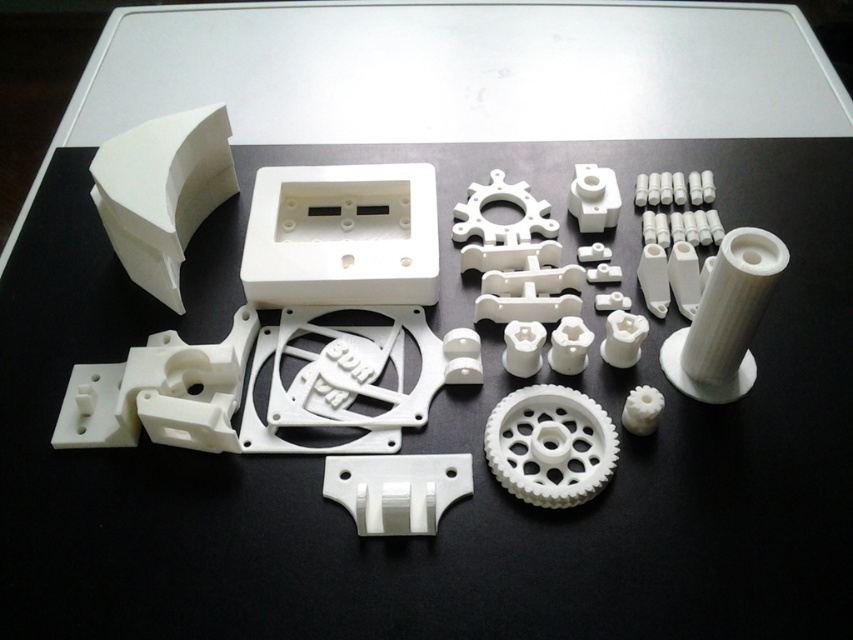
Question: Is white matte plastic gear at upper left wider than white matte gear at center?

Choices:
 (A) yes
 (B) no

Answer: (A)

Question: Does white matte plastic gear at upper left appear over white plastic gear at center?

Choices:
 (A) no
 (B) yes

Answer: (B)

Question: Which of the following is the closest to the observer?

Choices:
 (A) (577, 461)
 (B) (589, 228)

Answer: (A)

Question: Which point appears farthest from the camera in this image?

Choices:
 (A) (585, 179)
 (B) (99, 177)
 (C) (534, 445)

Answer: (A)

Question: Which object appears closest to the camera in this image?

Choices:
 (A) white matte gear at center
 (B) white plastic gear at center

Answer: (B)

Question: Does white matte plastic gear at upper left appear over white matte gear at center?

Choices:
 (A) no
 (B) yes

Answer: (A)